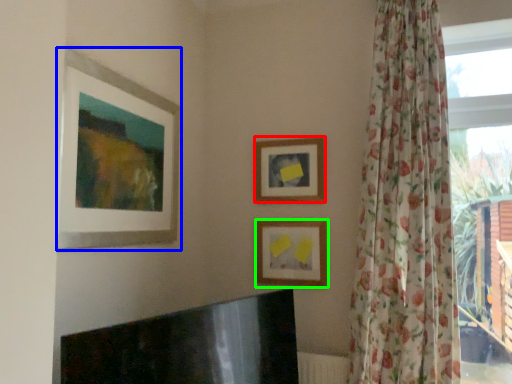
Question: Which object is the farthest from picture frame (highlighted by a red box)? Choose among these: picture frame (highlighted by a blue box) or picture frame (highlighted by a green box).

Choices:
 (A) picture frame
 (B) picture frame

Answer: (A)